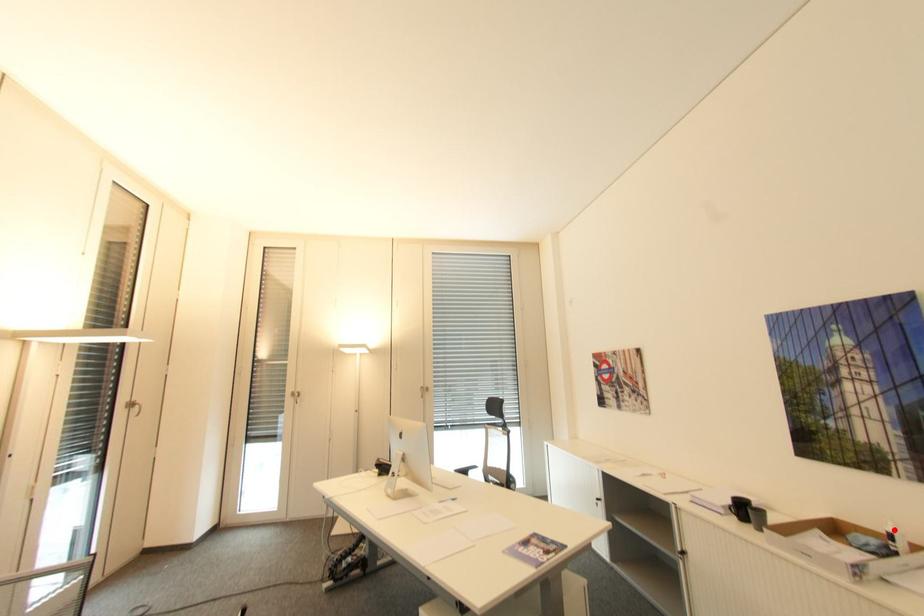
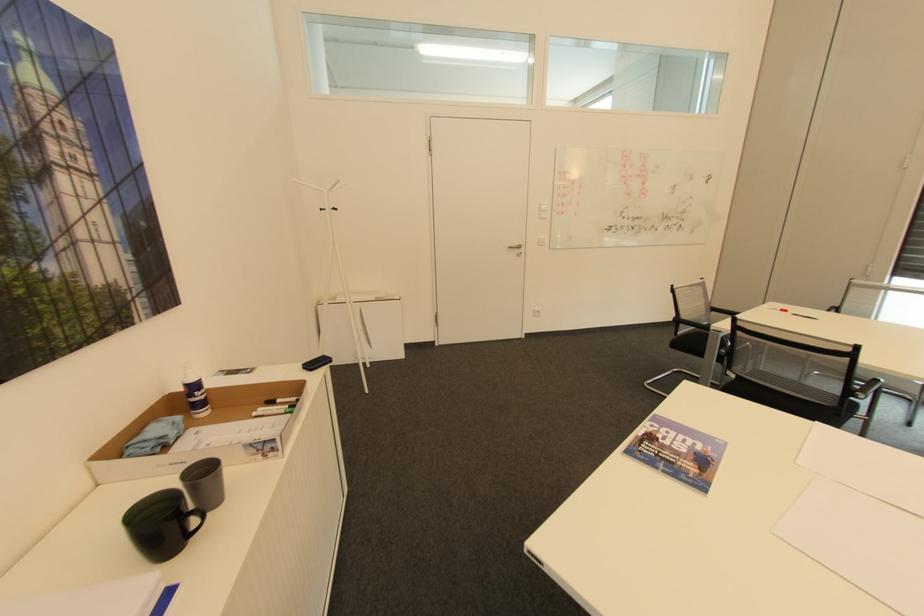
Locate, in the second image, the point that corresponds to the highlighted location in the first image.

(197, 379)